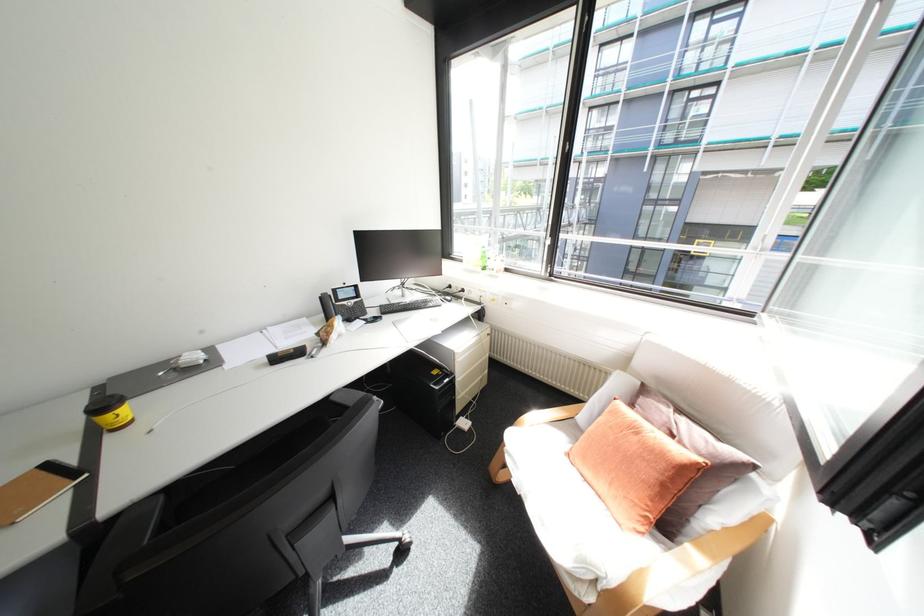
Find where to typ the computer keyboard. Please return your answer as a coordinate pair (x, y).

(409, 305)